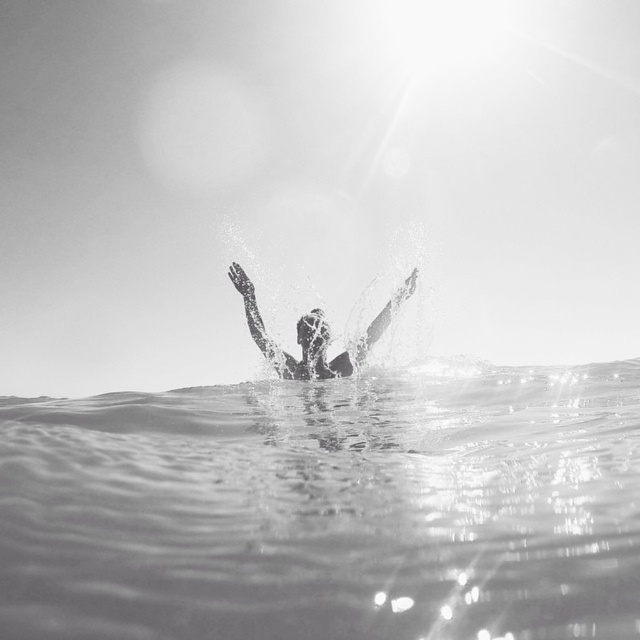
Between point (198, 497) and point (342, 372), which one is positioned in front?

Point (198, 497) is more forward.

How far apart are clear water at center and silhouette smooth skin at center?

A distance of 4.90 meters exists between clear water at center and silhouette smooth skin at center.

Who is more distant from viewer, (227, 609) or (340, 362)?

Point (340, 362)

This screenshot has width=640, height=640. Identify the location of clear water at center. (326, 508).